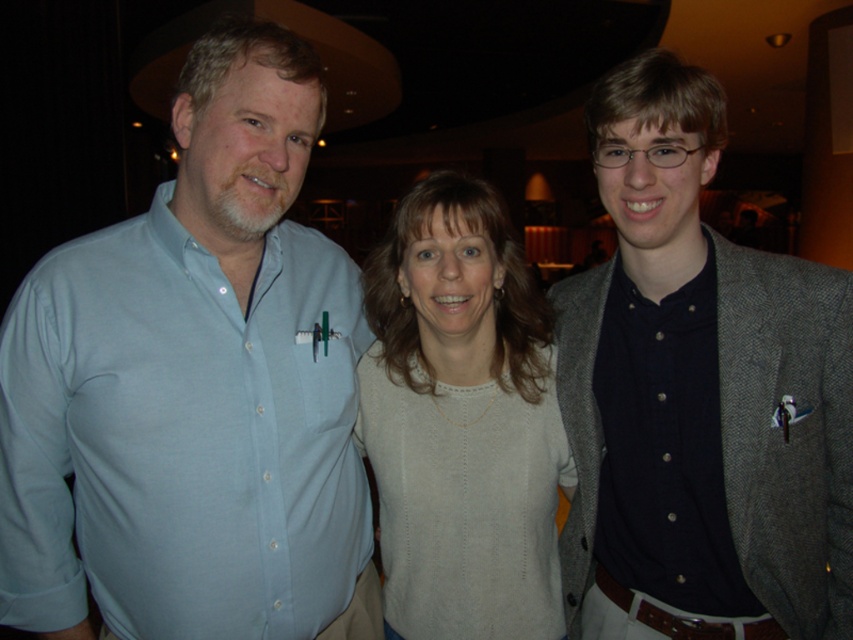
Does light blue shirt at left come behind light gray sweater at center?

No, light blue shirt at left is closer to the viewer.

From the picture: Which of these two, light blue shirt at left or light gray sweater at center, stands shorter?

Standing shorter between the two is light gray sweater at center.

What do you see at coordinates (194, 388) in the screenshot? Image resolution: width=853 pixels, height=640 pixels. I see `light blue shirt at left` at bounding box center [194, 388].

In order to click on light blue shirt at left in this screenshot , I will do point(194,388).

Does dark gray wool blazer at right have a larger size compared to light gray sweater at center?

Yes, dark gray wool blazer at right is bigger than light gray sweater at center.

Between dark gray wool blazer at right and light gray sweater at center, which one is positioned lower?

Positioned lower is light gray sweater at center.

Between point (746, 472) and point (531, 516), which one is positioned in front?

Point (746, 472) is in front.

Image resolution: width=853 pixels, height=640 pixels. Find the location of `dark gray wool blazer at right`. dark gray wool blazer at right is located at coordinates (700, 387).

Looking at this image, who is more forward, (158,348) or (734,353)?

Point (158,348)

Identify the location of light blue shirt at left. Image resolution: width=853 pixels, height=640 pixels. (194, 388).